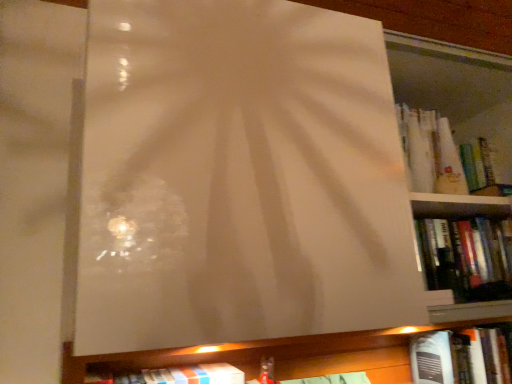
Question: In terms of width, does hardcover book at upper right, the 3th book viewed from the right, look wider or thinner when compared to hardcover book at lower right, which is the fourth book in left-to-right order?

Choices:
 (A) wide
 (B) thin

Answer: (B)

Question: From the image's perspective, is hardcover book at upper right, which appears as the second book when viewed from the top, located above or below hardcover book at lower right, which ranks as the first book in bottom-to-top order?

Choices:
 (A) below
 (B) above

Answer: (B)

Question: Which of these objects is positioned closest to the white matte book at lower center, placed as the 4th book when sorted from right to left?

Choices:
 (A) hardcover book at upper right, the 2th book in the left-to-right sequence
 (B) hardcover book at upper right, which ranks as the second book in right-to-left order
 (C) hardcover book at lower right, which ranks as the first book in bottom-to-top order

Answer: (A)

Question: Estimate the real-world distances between objects in this image. Which object is farther from the white matte book at lower center, the 2th book positioned from the bottom?

Choices:
 (A) hardcover book at upper right, which appears as the second book when viewed from the top
 (B) hardcover book at upper right, acting as the 4th book starting from the bottom
 (C) hardcover book at lower right, acting as the fourth book starting from the top

Answer: (B)